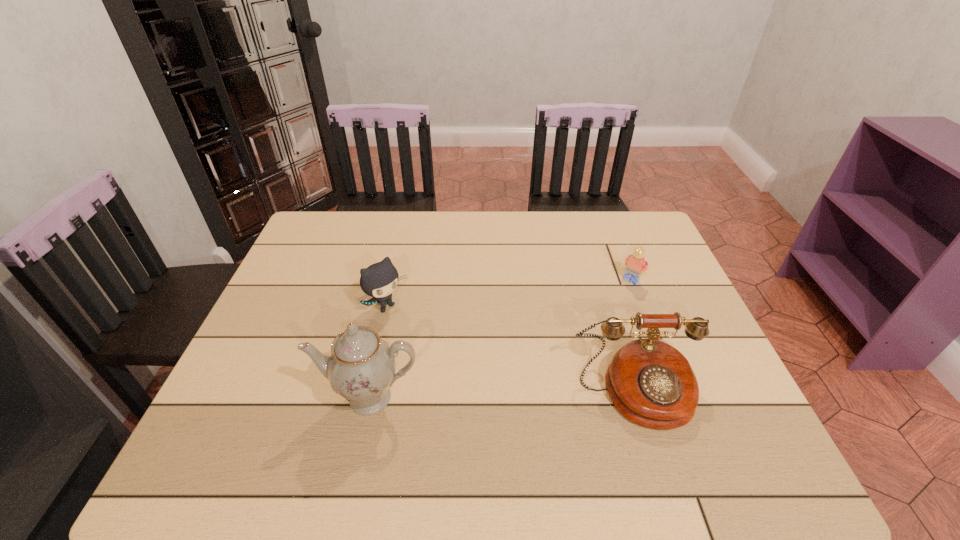
This screenshot has width=960, height=540. I want to click on blank area at the right edge, so click(698, 377).

Locate an element on the screen. The height and width of the screenshot is (540, 960). free location at the far left corner of the desktop is located at coordinates (322, 238).

At what (x,y) coordinates should I click in order to perform the action: click on free space at the far right corner. Please return your answer as a coordinate pair (x, y). Looking at the image, I should click on (633, 236).

At what (x,y) coordinates should I click in order to perform the action: click on free spot between the telephone and the shortest object. Please return your answer as a coordinate pair (x, y). The width and height of the screenshot is (960, 540). Looking at the image, I should click on (634, 336).

The image size is (960, 540). I want to click on vacant point located between the second tallest object and the second shortest object, so click(512, 350).

This screenshot has height=540, width=960. What are the coordinates of `free space that is in between the telephone and the Lego` in the screenshot? It's located at (634, 336).

Find the location of a particular element. empty space that is in between the tallest object and the telephone is located at coordinates (503, 395).

Where is `free spot between the farthest object and the second tallest object`? This screenshot has width=960, height=540. free spot between the farthest object and the second tallest object is located at coordinates (634, 336).

You are a GUI agent. You are given a task and a screenshot of the screen. Output one action in this format:
    pyautogui.click(x=<x>, y=<y>)
    Task: Click on the free space between the third shortest object and the Lego
    
    Given the screenshot: What is the action you would take?
    pyautogui.click(x=634, y=336)

Locate an element on the screen. object identified as the closest to the kitten is located at coordinates (361, 368).